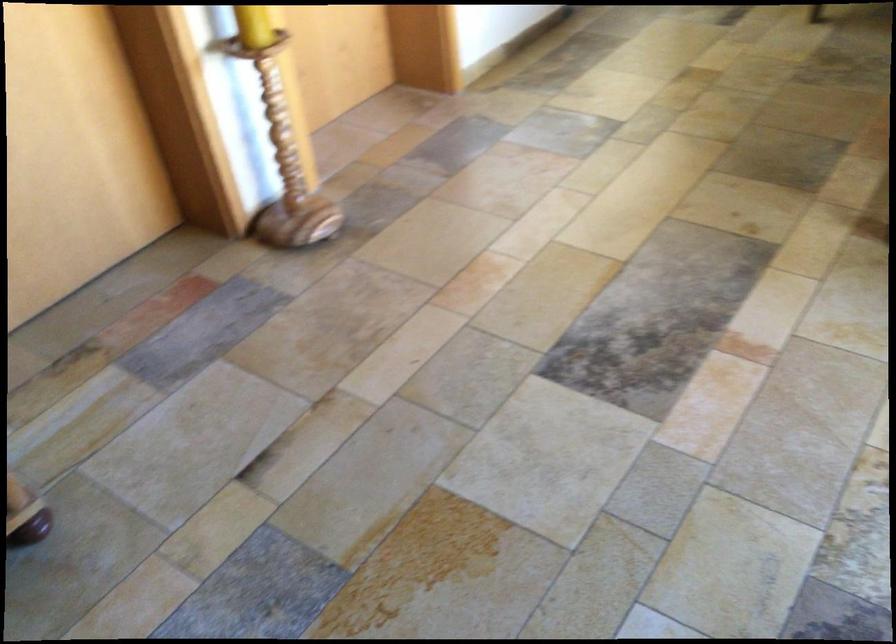
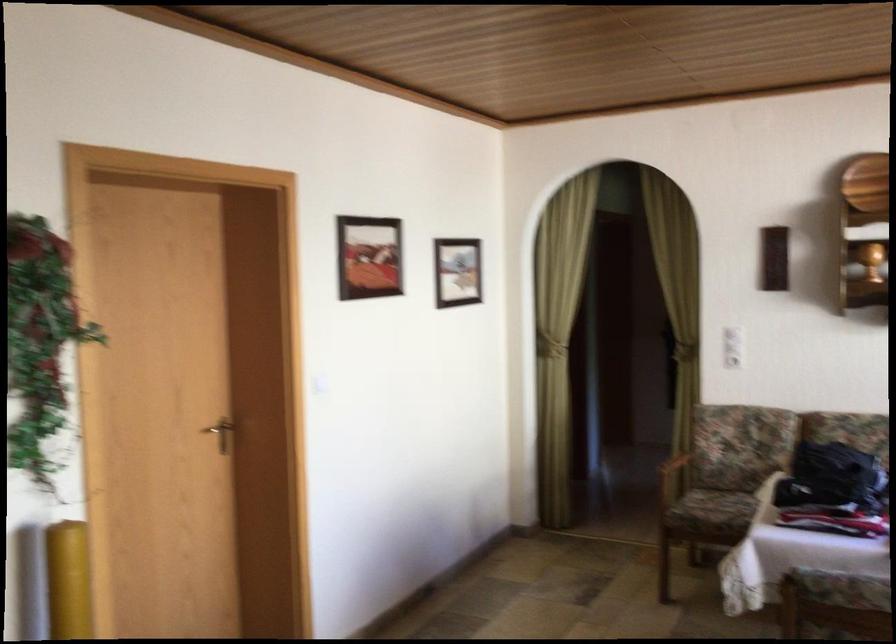
Question: Based on the continuous images, in which direction is the camera rotating? Reply with the corresponding letter.

Choices:
 (A) Left
 (B) Right
 (C) Up
 (D) Down

Answer: (C)